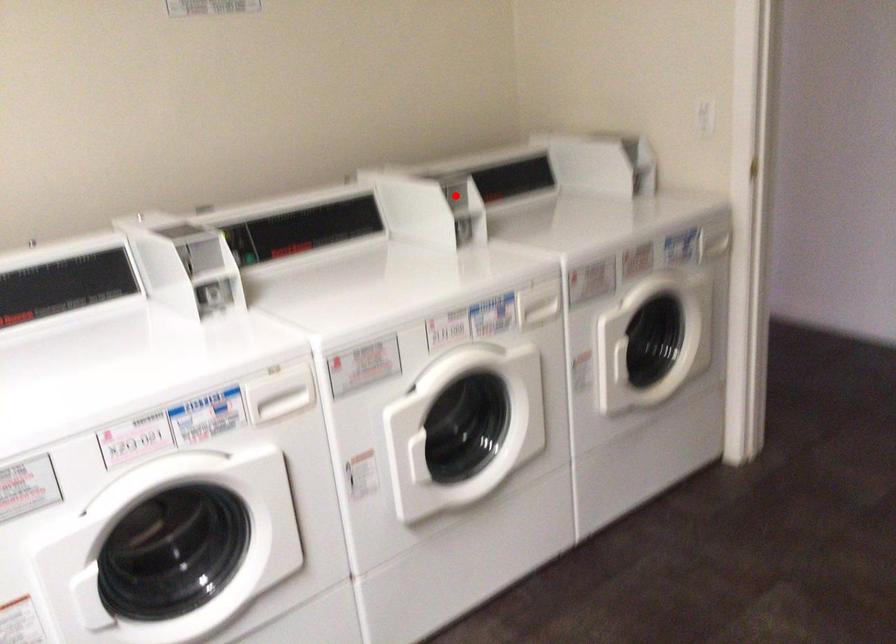
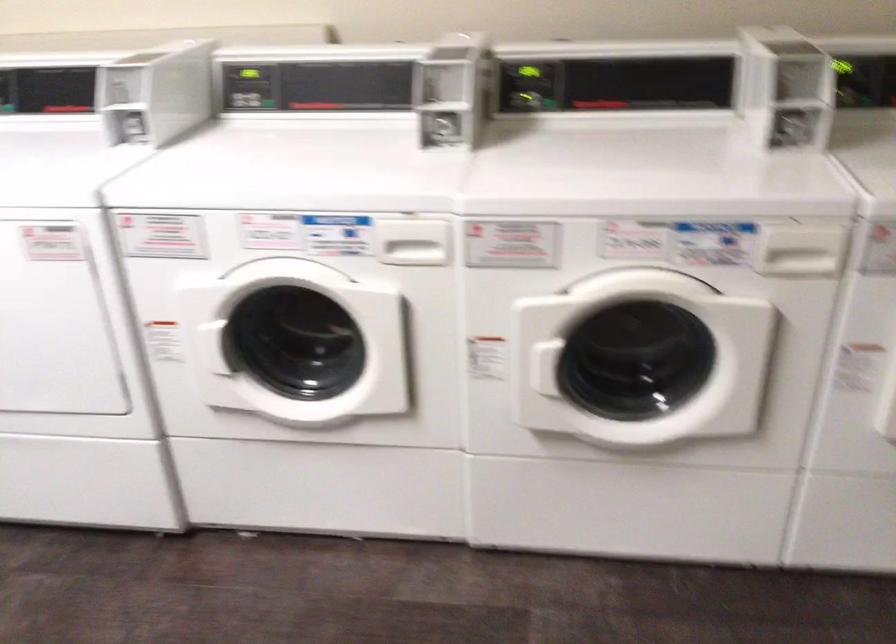
Question: A red point is marked in image1. In image2, is the corresponding 3D point closer to the camera or farther? Reply with the corresponding letter.

Choices:
 (A) The corresponding 3D point is closer.
 (B) The corresponding 3D point is farther.

Answer: (A)